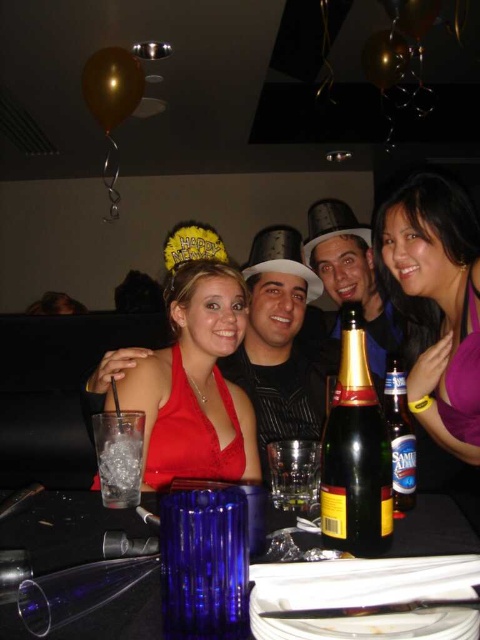
Is point (348, 540) less distant than point (405, 396)?

That is True.

Between green glass bottle at center and clear glass bottle at center, which one appears on the right side from the viewer's perspective?

clear glass bottle at center

Who is more forward, (325,476) or (384,381)?

Point (325,476)

At what (x,y) coordinates should I click in order to perform the action: click on green glass bottle at center. Please return your answer as a coordinate pair (x, y). The width and height of the screenshot is (480, 640). Looking at the image, I should click on (355, 452).

Is the position of matte red dress at center more distant than that of clear glass at lower left?

That is True.

Who is higher up, matte red dress at center or clear glass at lower left?

matte red dress at center is above.

Does point (130, 397) come farther from viewer compared to point (113, 468)?

That is True.

This screenshot has width=480, height=640. I want to click on matte red dress at center, so click(x=190, y=371).

Is blue glass vase at lower center shorter than green glass bottle at center?

Correct, blue glass vase at lower center is not as tall as green glass bottle at center.

What do you see at coordinates (64, 529) in the screenshot? The image size is (480, 640). I see `blue glass vase at lower center` at bounding box center [64, 529].

Locate an element on the screen. This screenshot has width=480, height=640. blue glass vase at lower center is located at coordinates (64, 529).